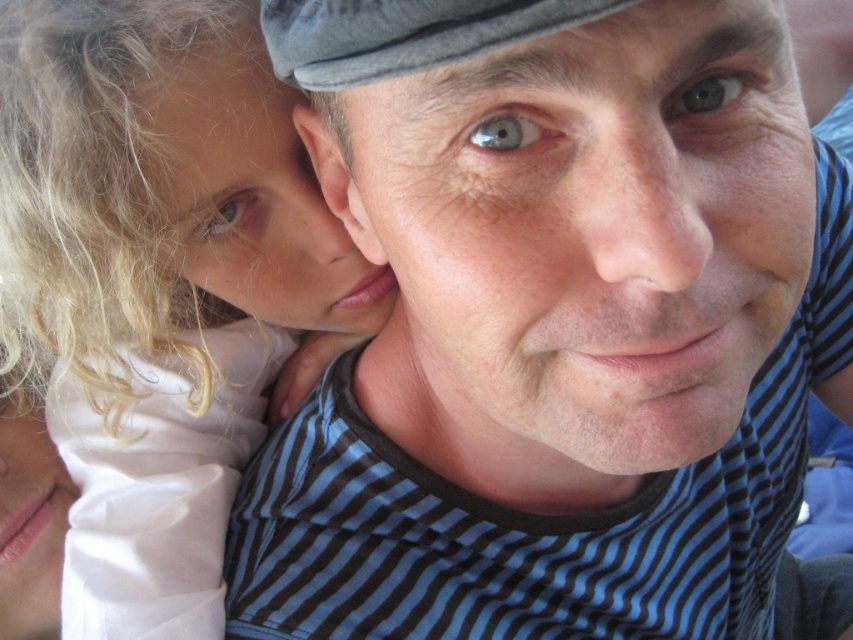
Where is the blue striped shirt at center located in the image?

The blue striped shirt at center is located at point (558, 328) in the image.

You are a photographer trying to focus on the blue striped shirt at center and the white satin dress at left. Which one should you adjust your camera focus to first if you want to capture both clearly?

You should focus on the blue striped shirt at center first since it is closer to the viewer than the white satin dress at left, allowing you to adjust the focus accordingly for both subjects.

You are a photographer trying to capture a photo of the blue striped shirt at center and the white satin dress at left. Based on their positions, which object is located more to the right?

The blue striped shirt at center is positioned on the right side of the white satin dress at left, so the blue striped shirt at center is more to the right.